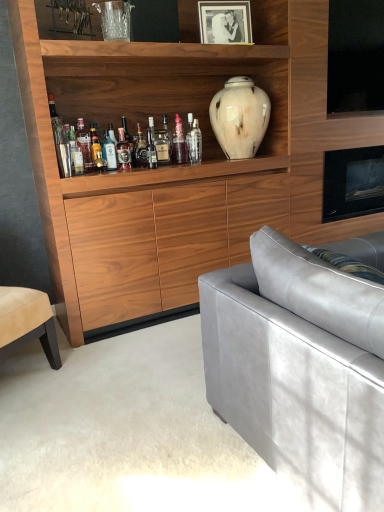
Question: In terms of width, does translucent glass bottle at shelf center, which is the second bottle from left to right, look wider or thinner when compared to translucent glass bottle at shelf center, positioned as the eighth bottle in left-to-right order?

Choices:
 (A) thin
 (B) wide

Answer: (B)

Question: Is translucent glass bottle at shelf center, acting as the eighth bottle starting from the right, situated inside translucent glass bottle at shelf center, positioned as the eighth bottle in left-to-right order, or outside?

Choices:
 (A) inside
 (B) outside

Answer: (B)

Question: Which object is positioned closest to the suede gray couch at right?

Choices:
 (A) translucent glass bottle at center
 (B) translucent glass bottle at center, which is counted as the 1th bottle, starting from the left
 (C) translucent glass bottle at shelf center, positioned as the eighth bottle in left-to-right order
 (D) white marble vase at upper center
 (E) black matte photo frame at upper center

Answer: (D)

Question: Which object is the farthest from the matte glass bottle at center, the seventh bottle from the right?

Choices:
 (A) wooden cupboard at center
 (B) translucent glass bottle at center, which is the 9th bottle in right-to-left order
 (C) translucent glass bottle at shelf center, which is the second bottle from left to right
 (D) suede gray couch at right
 (E) black matte photo frame at upper center

Answer: (D)